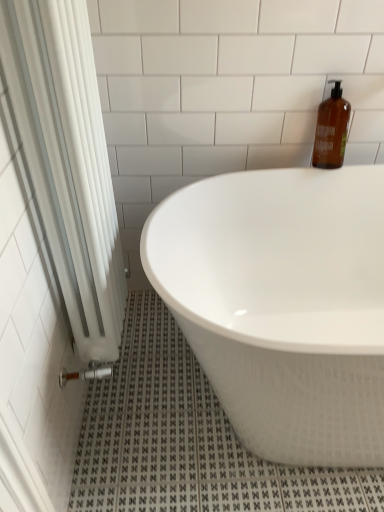
Question: From a real-world perspective, is amber glass bottle at upper right located beneath white glossy bathtub at center?

Choices:
 (A) yes
 (B) no

Answer: (B)

Question: Is amber glass bottle at upper right not inside white glossy bathtub at center?

Choices:
 (A) yes
 (B) no

Answer: (A)

Question: Is amber glass bottle at upper right closer to camera compared to white glossy bathtub at center?

Choices:
 (A) no
 (B) yes

Answer: (A)

Question: Can you confirm if amber glass bottle at upper right is taller than white glossy bathtub at center?

Choices:
 (A) no
 (B) yes

Answer: (A)

Question: Considering the relative sizes of amber glass bottle at upper right and white glossy bathtub at center in the image provided, is amber glass bottle at upper right wider than white glossy bathtub at center?

Choices:
 (A) yes
 (B) no

Answer: (B)

Question: In terms of height, does white fabric shower curtain at left look taller or shorter compared to amber glass bottle at upper right?

Choices:
 (A) tall
 (B) short

Answer: (A)

Question: Considering the positions of white fabric shower curtain at left and amber glass bottle at upper right in the image, is white fabric shower curtain at left wider or thinner than amber glass bottle at upper right?

Choices:
 (A) thin
 (B) wide

Answer: (B)

Question: In the image, is white fabric shower curtain at left positioned in front of or behind amber glass bottle at upper right?

Choices:
 (A) front
 (B) behind

Answer: (A)

Question: Considering the relative positions of white fabric shower curtain at left and amber glass bottle at upper right in the image provided, is white fabric shower curtain at left to the left or to the right of amber glass bottle at upper right?

Choices:
 (A) left
 (B) right

Answer: (A)

Question: From their relative heights in the image, would you say amber glass bottle at upper right is taller or shorter than white fabric shower curtain at left?

Choices:
 (A) tall
 (B) short

Answer: (B)

Question: From the image's perspective, is amber glass bottle at upper right above or below white fabric shower curtain at left?

Choices:
 (A) above
 (B) below

Answer: (A)

Question: Would you say amber glass bottle at upper right is inside or outside white fabric shower curtain at left?

Choices:
 (A) outside
 (B) inside

Answer: (A)

Question: From a real-world perspective, is amber glass bottle at upper right positioned above or below white fabric shower curtain at left?

Choices:
 (A) above
 (B) below

Answer: (A)

Question: Is amber glass bottle at upper right wider or thinner than white glossy bathtub at center?

Choices:
 (A) thin
 (B) wide

Answer: (A)

Question: Is amber glass bottle at upper right inside the boundaries of white glossy bathtub at center, or outside?

Choices:
 (A) outside
 (B) inside

Answer: (A)